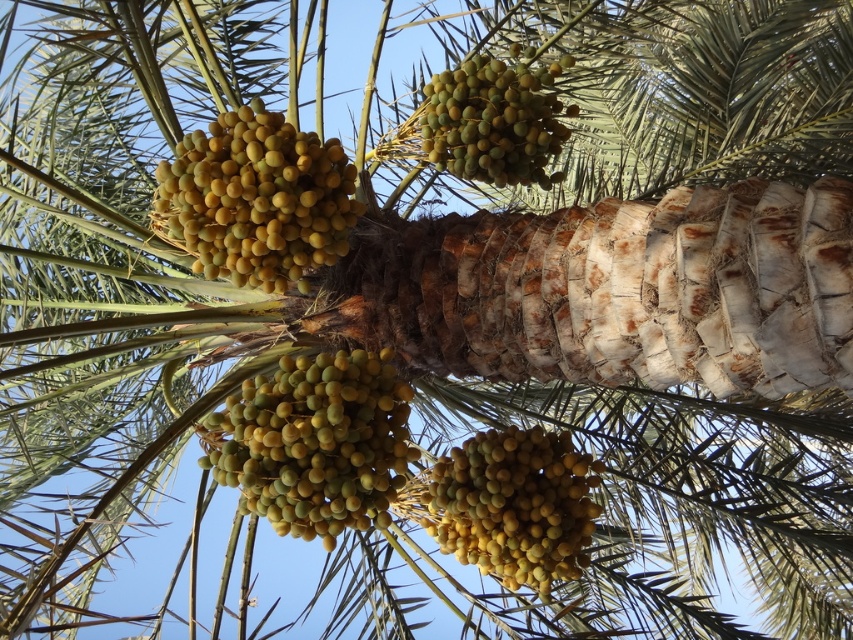
Question: Which object appears farthest from the camera in this image?

Choices:
 (A) yellow matte dates at center
 (B) green matte dates at center
 (C) yellow matte dates at upper left

Answer: (B)

Question: Which object appears closest to the camera in this image?

Choices:
 (A) yellow matte dates at upper left
 (B) yellow matte dates at center
 (C) yellow matte fruit at center
 (D) green matte dates at center

Answer: (C)

Question: Does yellow matte dates at upper left have a larger size compared to yellow matte dates at center?

Choices:
 (A) no
 (B) yes

Answer: (B)

Question: Is yellow matte fruit at center to the right of green matte dates at center from the viewer's perspective?

Choices:
 (A) no
 (B) yes

Answer: (A)

Question: Is yellow matte fruit at center to the right of yellow matte dates at upper left from the viewer's perspective?

Choices:
 (A) yes
 (B) no

Answer: (A)

Question: Among these objects, which one is farthest from the camera?

Choices:
 (A) yellow matte fruit at center
 (B) yellow matte dates at center
 (C) yellow matte dates at upper left

Answer: (B)